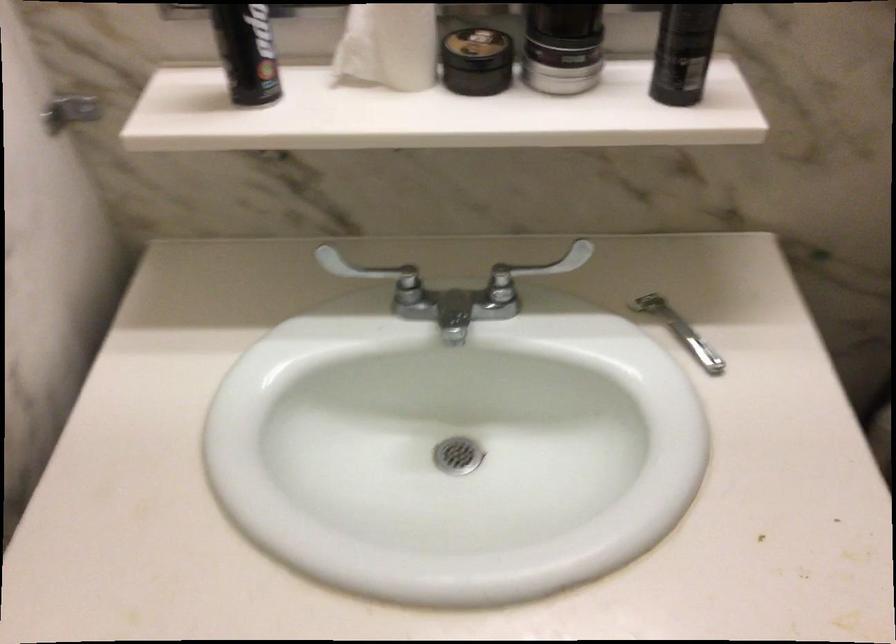
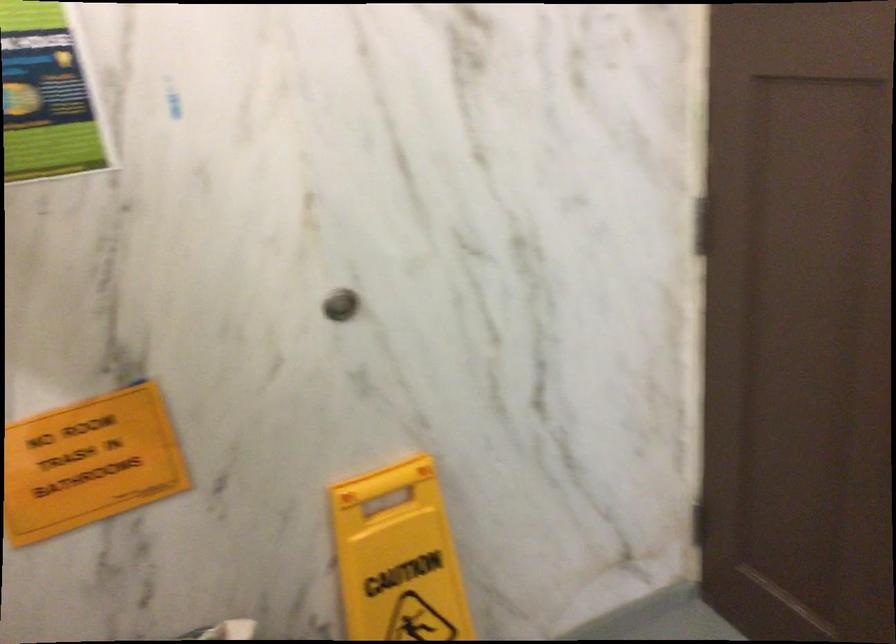
In the scene shown: How did the camera likely rotate?

The camera's rotation is toward right-down.